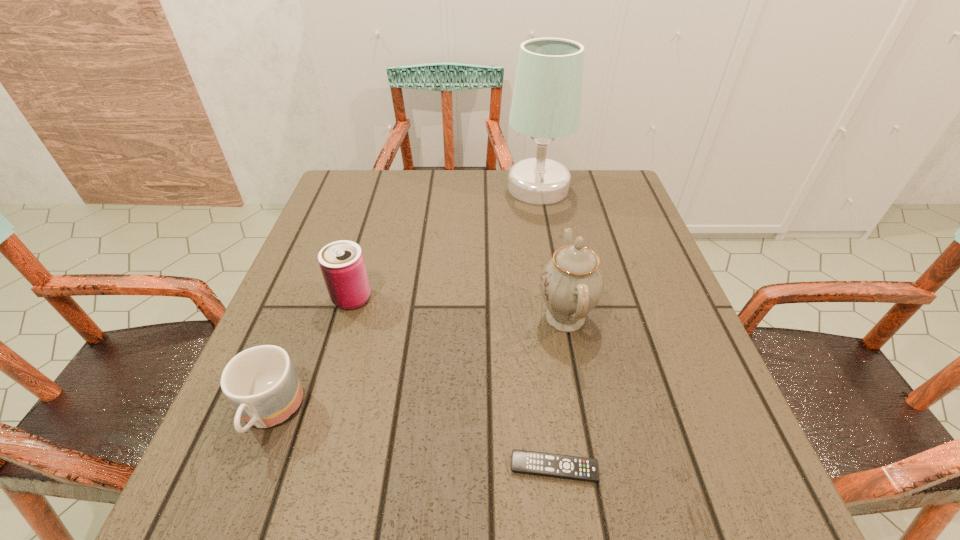
Point out which object is positioned as the nearest to the lampshade. Please provide its 2D coordinates. Your answer should be formatted as a tuple, i.e. [(x, y)], where the tuple contains the x and y coordinates of a point satisfying the conditions above.

[(571, 283)]

Locate an element on the screen. The height and width of the screenshot is (540, 960). free space that satisfies the following two spatial constraints: 1. on the spout of the chinaware; 2. on the side with the handle of the mug is located at coordinates (583, 414).

Find the location of `free location that satisfies the following two spatial constraints: 1. on the base of the tallest object; 2. on the front side of the can`. free location that satisfies the following two spatial constraints: 1. on the base of the tallest object; 2. on the front side of the can is located at coordinates (558, 298).

Locate an element on the screen. The image size is (960, 540). vacant space that satisfies the following two spatial constraints: 1. on the base of the farthest object; 2. on the side with the handle of the fourth tallest object is located at coordinates (x=579, y=414).

The width and height of the screenshot is (960, 540). I want to click on free space that satisfies the following two spatial constraints: 1. on the base of the tallest object; 2. on the side with the handle of the mug, so [x=579, y=414].

Where is `vacant space that satisfies the following two spatial constraints: 1. on the base of the lampshade; 2. on the side with the handle of the fourth tallest object`? The image size is (960, 540). vacant space that satisfies the following two spatial constraints: 1. on the base of the lampshade; 2. on the side with the handle of the fourth tallest object is located at coordinates (579, 414).

The width and height of the screenshot is (960, 540). I want to click on vacant point that satisfies the following two spatial constraints: 1. on the base of the farthest object; 2. on the side with the handle of the mug, so click(x=579, y=414).